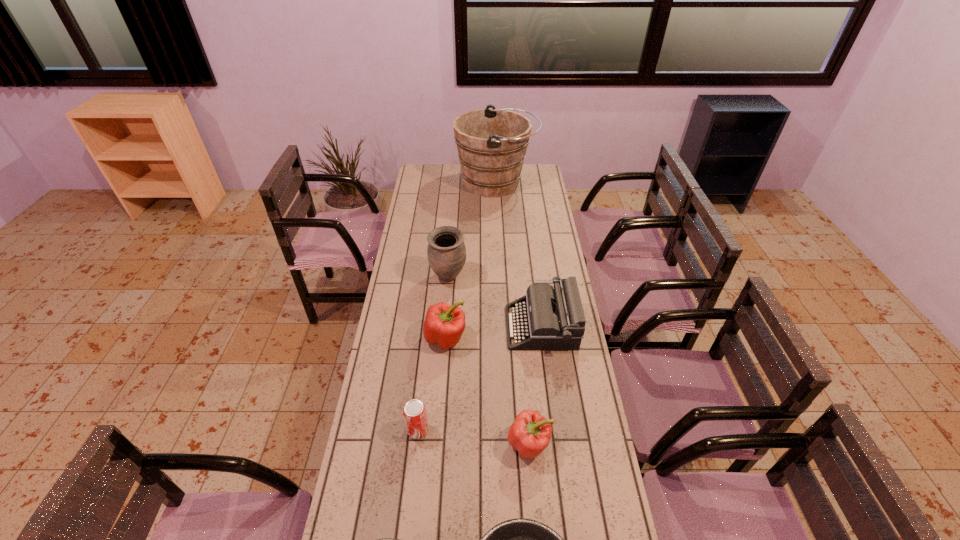
At what (x,y) coordinates should I click in order to perform the action: click on free space located 0.220m on the right of the urn. Please return your answer as a coordinate pair (x, y). Looking at the image, I should click on (517, 278).

The image size is (960, 540). I want to click on free space located on the typing side of the typewriter, so click(433, 327).

At what (x,y) coordinates should I click in order to perform the action: click on free region located on the typing side of the typewriter. Please return your answer as a coordinate pair (x, y). Looking at the image, I should click on tap(487, 327).

You are a GUI agent. You are given a task and a screenshot of the screen. Output one action in this format:
    pyautogui.click(x=<x>, y=<y>)
    Task: Click on the vacant space situated on the typing side of the typewriter
    
    Given the screenshot: What is the action you would take?
    pyautogui.click(x=456, y=327)

This screenshot has width=960, height=540. Identify the location of vacant space located on the front of the left bell pepper. (437, 459).

Identify the location of free space located 0.220m on the left of the shorter bell pepper. The width and height of the screenshot is (960, 540). (437, 444).

Identify the location of vacant space located on the back of the soda can. The height and width of the screenshot is (540, 960). (424, 373).

Locate an element on the screen. The width and height of the screenshot is (960, 540). object that is at the far edge is located at coordinates (491, 143).

This screenshot has width=960, height=540. What are the coordinates of `urn present at the left edge` in the screenshot? It's located at coord(446,251).

You are a GUI agent. You are given a task and a screenshot of the screen. Output one action in this format:
    pyautogui.click(x=<x>, y=<y>)
    Task: Click on the soda can present at the left edge
    
    Given the screenshot: What is the action you would take?
    pyautogui.click(x=414, y=412)